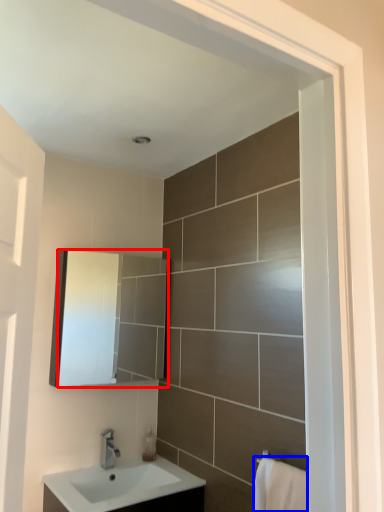
Question: Which object appears farthest to the camera in this image, mirror (highlighted by a red box) or bath towel (highlighted by a blue box)?

Choices:
 (A) mirror
 (B) bath towel

Answer: (A)